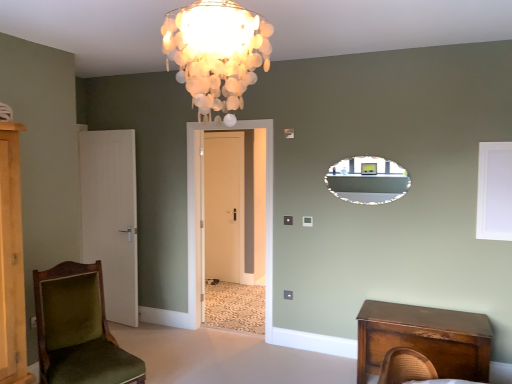
What is the approximate height of ivory shell chandelier at upper center?

ivory shell chandelier at upper center is 22.97 inches in height.

What do you see at coordinates (367, 180) in the screenshot? I see `matte black mirror at upper center` at bounding box center [367, 180].

At what (x,y) coordinates should I click in order to perform the action: click on matte black mirror at upper center. Please return your answer as a coordinate pair (x, y). The height and width of the screenshot is (384, 512). Looking at the image, I should click on (367, 180).

What is the approximate width of white matte door at center, which is the 3th door from back to front?

It is 8.90 inches.

What do you see at coordinates (111, 217) in the screenshot?
I see `white matte door at left, which is the third door from right to left` at bounding box center [111, 217].

What do you see at coordinates (425, 338) in the screenshot? I see `wooden nightstand at lower right` at bounding box center [425, 338].

You are a GUI agent. You are given a task and a screenshot of the screen. Output one action in this format:
    pyautogui.click(x=<x>, y=<y>)
    Task: Click on the beige matte door at center, the 1th door positioned from the back
    
    Given the screenshot: What is the action you would take?
    pyautogui.click(x=224, y=205)

The width and height of the screenshot is (512, 384). What do you see at coordinates (224, 205) in the screenshot?
I see `beige matte door at center, the 1th door positioned from the back` at bounding box center [224, 205].

Measure the distance between point (89, 353) and camera.

Point (89, 353) and camera are 2.94 meters apart.

What do you see at coordinates (78, 329) in the screenshot? The image size is (512, 384). I see `velvet green chair at lower left` at bounding box center [78, 329].

Find the location of a particular element. Image resolution: width=512 pixels, height=384 pixels. ivory shell chandelier at upper center is located at coordinates (216, 53).

Locate an element on the screen. The image size is (512, 384). lamp above the white matte door at center, marked as the 1th door in a right-to-left arrangement (from a real-world perspective) is located at coordinates tap(216, 53).

Consider the image. Which of these two, ivory shell chandelier at upper center or white matte door at center, the 1th door viewed from the front, is thinner?

With smaller width is white matte door at center, the 1th door viewed from the front.

Considering the positions of objects ivory shell chandelier at upper center and white matte door at center, the third door positioned from the left, in the image provided, who is more to the right, ivory shell chandelier at upper center or white matte door at center, the third door positioned from the left,?

ivory shell chandelier at upper center.

Considering the relative sizes of ivory shell chandelier at upper center and matte black mirror at upper center in the image provided, is ivory shell chandelier at upper center bigger than matte black mirror at upper center?

Yes, ivory shell chandelier at upper center is bigger than matte black mirror at upper center.

From a real-world perspective, is ivory shell chandelier at upper center positioned over matte black mirror at upper center based on gravity?

Yes, from a real-world perspective, ivory shell chandelier at upper center is over matte black mirror at upper center

Locate an element on the screen. The image size is (512, 384). mirror located below the ivory shell chandelier at upper center (from the image's perspective) is located at coordinates (367, 180).

Considering the relative positions of ivory shell chandelier at upper center and matte black mirror at upper center in the image provided, is ivory shell chandelier at upper center in front of matte black mirror at upper center?

That is True.

Does white matte window screen at upper right turn towards white matte door at center, the 1th door viewed from the front?

No, white matte window screen at upper right is not aimed at white matte door at center, the 1th door viewed from the front.

Which object is closer to the camera, white matte window screen at upper right or white matte door at center, the third door positioned from the left?

white matte window screen at upper right is more forward.

From a real-world perspective, is white matte window screen at upper right physically located above or below white matte door at center, the third door positioned from the left?

white matte window screen at upper right is above white matte door at center, the third door positioned from the left.

Which object is positioned more to the right, white matte door at center, the third door positioned from the left, or ivory shell chandelier at upper center?

ivory shell chandelier at upper center is more to the right.

Between point (269, 168) and point (205, 27), which one is positioned in front?

The point (205, 27) is in front.

Consider the image. Considering their positions, is white matte door at center, the 1th door viewed from the front, located in front of or behind ivory shell chandelier at upper center?

Clearly, white matte door at center, the 1th door viewed from the front, is behind ivory shell chandelier at upper center.

Is white matte door at center, the 1th door viewed from the front, positioned with its back to ivory shell chandelier at upper center?

No.

Is beige matte door at center, the second door when ordered from left to right, positioned with its back to matte black mirror at upper center?

No.

Relative to matte black mirror at upper center, is beige matte door at center, the second door when ordered from left to right, in front or behind?

Visually, beige matte door at center, the second door when ordered from left to right, is located behind matte black mirror at upper center.

Is beige matte door at center, the 1th door positioned from the back, at the right side of matte black mirror at upper center?

No.

Is point (221, 152) positioned behind point (380, 201)?

Yes.

Which is further, [253,46] or [71,344]?

Positioned behind is point [71,344].

Between ivory shell chandelier at upper center and velvet green chair at lower left, which one appears on the left side from the viewer's perspective?

velvet green chair at lower left.

Which is behind, ivory shell chandelier at upper center or velvet green chair at lower left?

velvet green chair at lower left is further away from the camera.

Considering the positions of points (115, 356) and (260, 51), is point (115, 356) closer to camera compared to point (260, 51)?

That is False.

From the image's perspective, is velvet green chair at lower left positioned above or below ivory shell chandelier at upper center?

Based on their image positions, velvet green chair at lower left is located beneath ivory shell chandelier at upper center.

In the image, is velvet green chair at lower left positioned in front of or behind ivory shell chandelier at upper center?

velvet green chair at lower left is behind ivory shell chandelier at upper center.

Considering the sizes of objects velvet green chair at lower left and ivory shell chandelier at upper center in the image provided, who is thinner, velvet green chair at lower left or ivory shell chandelier at upper center?

ivory shell chandelier at upper center.

The image size is (512, 384). Find the location of `lamp in front of the white matte door at center, which is the 3th door from back to front`. lamp in front of the white matte door at center, which is the 3th door from back to front is located at coordinates (216, 53).

The height and width of the screenshot is (384, 512). What are the coordinates of `lamp on the left of the matte black mirror at upper center` in the screenshot? It's located at (216, 53).

Which object lies further to the anchor point white matte door at center, marked as the 1th door in a right-to-left arrangement, velvet green chair at lower left or matte black mirror at upper center?

Among the two, velvet green chair at lower left is located further to white matte door at center, marked as the 1th door in a right-to-left arrangement.

From the image, which object appears to be farther from white matte window screen at upper right, matte black mirror at upper center or ivory shell chandelier at upper center?

ivory shell chandelier at upper center is further to white matte window screen at upper right.

Considering their positions, is matte black mirror at upper center positioned closer to white matte window screen at upper right than velvet green chair at lower left?

The object closer to white matte window screen at upper right is matte black mirror at upper center.

Based on their spatial positions, is ivory shell chandelier at upper center or velvet green chair at lower left closer to matte black mirror at upper center?

ivory shell chandelier at upper center lies closer to matte black mirror at upper center than the other object.

Which object lies further to the anchor point white matte door at left, which ranks as the 2th door in back-to-front order, white matte door at center, which is the 3th door from back to front, or beige matte door at center, the 2th door viewed from the right?

Based on the image, beige matte door at center, the 2th door viewed from the right, appears to be further to white matte door at left, which ranks as the 2th door in back-to-front order.

Based on their spatial positions, is beige matte door at center, the 2th door viewed from the right, or white matte window screen at upper right further from velvet green chair at lower left?

The object further to velvet green chair at lower left is beige matte door at center, the 2th door viewed from the right.

Estimate the real-world distances between objects in this image. Which object is further from white matte door at left, which is the third door from right to left, wooden nightstand at lower right or ivory shell chandelier at upper center?

Among the two, ivory shell chandelier at upper center is located further to white matte door at left, which is the third door from right to left.

In the scene shown: From the image, which object appears to be nearer to wooden nightstand at lower right, beige matte door at center, positioned as the third door in front-to-back order, or matte black mirror at upper center?

matte black mirror at upper center is closer to wooden nightstand at lower right.

The height and width of the screenshot is (384, 512). What are the coordinates of `chair between white matte door at left, which ranks as the 2th door in back-to-front order, and wooden nightstand at lower right, in the horizontal direction` in the screenshot? It's located at (78, 329).

Find the location of a particular element. The image size is (512, 384). nightstand located between ivory shell chandelier at upper center and white matte door at left, placed as the second door when sorted from front to back, in the depth direction is located at coordinates (425, 338).

You are a GUI agent. You are given a task and a screenshot of the screen. Output one action in this format:
    pyautogui.click(x=<x>, y=<y>)
    Task: Click on the mirror between velvet green chair at lower left and beige matte door at center, the 1th door positioned from the back, along the z-axis
    The height and width of the screenshot is (384, 512).
    Given the screenshot: What is the action you would take?
    pyautogui.click(x=367, y=180)

Where is `chair between white matte door at left, which ranks as the 2th door in back-to-front order, and matte black mirror at upper center from left to right`? chair between white matte door at left, which ranks as the 2th door in back-to-front order, and matte black mirror at upper center from left to right is located at coordinates (78, 329).